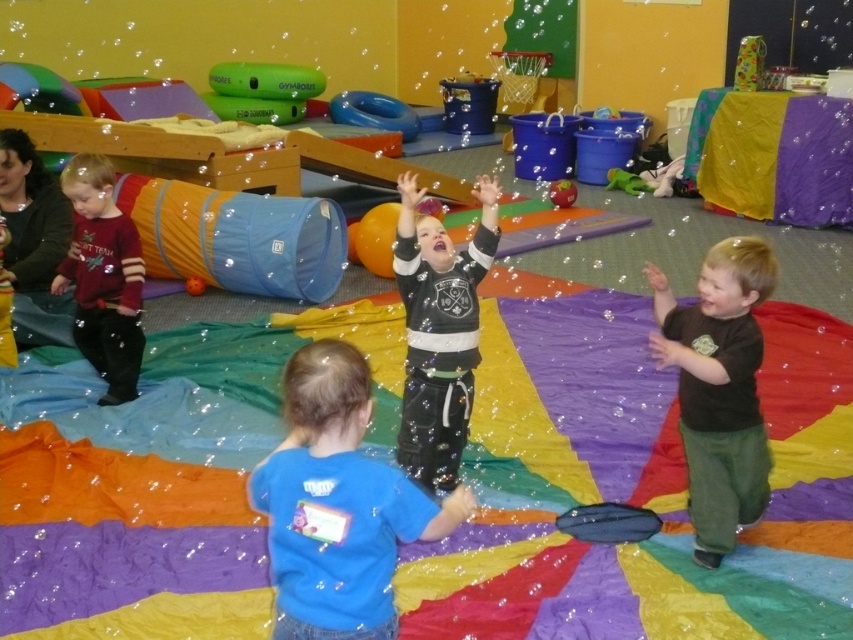
Question: Considering the real-world distances, which object is closest to the orange matte ball at center?

Choices:
 (A) brown cotton shirt at right
 (B) rubber ball at center
 (C) green fabric at center
 (D) matte black jersey at center

Answer: (D)

Question: Which is farther from the blue rubber ring at upper center?

Choices:
 (A) rubber ball at center
 (B) green rubber ball at upper center
 (C) brown cotton shirt at right

Answer: (C)

Question: Observing the image, what is the correct spatial positioning of blue rubber ring at upper center in reference to orange matte ball at center?

Choices:
 (A) right
 (B) left

Answer: (A)

Question: Which object is farther from the camera taking this photo?

Choices:
 (A) blue rubber ring at upper center
 (B) blue cotton shirt at center
 (C) green rubber ball at upper center

Answer: (A)

Question: Is matte black jersey at center behind orange matte ball at center?

Choices:
 (A) yes
 (B) no

Answer: (B)

Question: Is matte red sweater at left closer to the viewer compared to blue rubber ring at upper center?

Choices:
 (A) yes
 (B) no

Answer: (A)